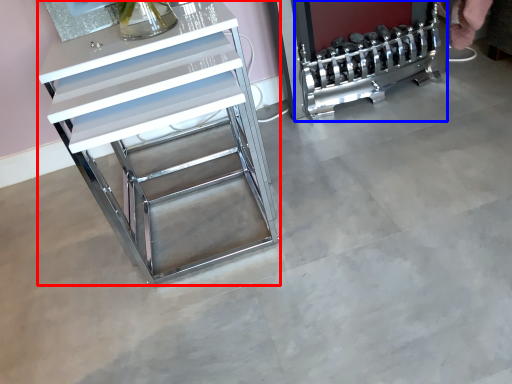
Question: Which of the following is the farthest to the observer, furniture (highlighted by a red box) or appliance (highlighted by a blue box)?

Choices:
 (A) furniture
 (B) appliance

Answer: (B)